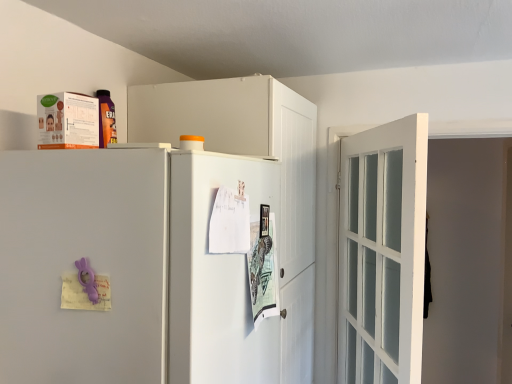
Question: Is there a large distance between white matte cabinet at upper center and white matte refrigerator at center?

Choices:
 (A) yes
 (B) no

Answer: (B)

Question: Is white matte cabinet at upper center to the right of white matte refrigerator at center from the viewer's perspective?

Choices:
 (A) yes
 (B) no

Answer: (A)

Question: Is white matte cabinet at upper center taller than white matte refrigerator at center?

Choices:
 (A) yes
 (B) no

Answer: (A)

Question: Is white matte cabinet at upper center wider than white matte refrigerator at center?

Choices:
 (A) no
 (B) yes

Answer: (A)

Question: Is white matte cabinet at upper center oriented towards white matte refrigerator at center?

Choices:
 (A) yes
 (B) no

Answer: (B)

Question: Can you confirm if white matte cabinet at upper center is thinner than white matte refrigerator at center?

Choices:
 (A) yes
 (B) no

Answer: (A)

Question: Is white glossy screen door at center closer to camera compared to white glass door at right?

Choices:
 (A) no
 (B) yes

Answer: (B)

Question: Can you confirm if white glossy screen door at center is shorter than white glass door at right?

Choices:
 (A) no
 (B) yes

Answer: (B)

Question: Is white glossy screen door at center completely or partially outside of white glass door at right?

Choices:
 (A) no
 (B) yes

Answer: (B)

Question: Considering the relative positions of white glossy screen door at center and white glass door at right in the image provided, is white glossy screen door at center to the right of white glass door at right from the viewer's perspective?

Choices:
 (A) no
 (B) yes

Answer: (A)

Question: From a real-world perspective, does white glossy screen door at center stand above white glass door at right?

Choices:
 (A) yes
 (B) no

Answer: (A)

Question: Is white glossy screen door at center bigger than white glass door at right?

Choices:
 (A) no
 (B) yes

Answer: (A)

Question: Is white glass door at right beside white matte cabinet at upper center?

Choices:
 (A) no
 (B) yes

Answer: (A)